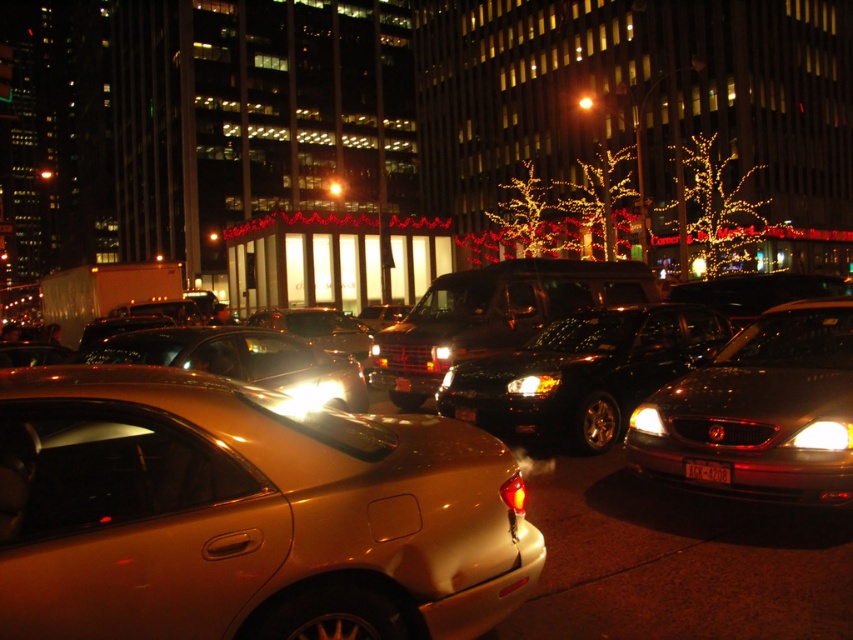
Question: Considering the real-world distances, which object is closest to the white glossy headlight at center?

Choices:
 (A) gold metallic car at center
 (B) matte gold headlight at center-right

Answer: (B)

Question: Considering the relative positions of white glossy headlight at center and matte gold headlight at center-right in the image provided, where is white glossy headlight at center located with respect to matte gold headlight at center-right?

Choices:
 (A) right
 (B) left

Answer: (A)

Question: Considering the relative positions of shiny black suv at center and white glossy headlight at center in the image provided, where is shiny black suv at center located with respect to white glossy headlight at center?

Choices:
 (A) right
 (B) left

Answer: (B)

Question: Which of the following is the farthest from the observer?

Choices:
 (A) (234, 337)
 (B) (845, 448)
 (C) (558, 320)
 (D) (659, 428)

Answer: (C)

Question: Among these points, which one is nearest to the camera?

Choices:
 (A) (851, 445)
 (B) (154, 557)
 (C) (727, 464)
 (D) (537, 436)

Answer: (B)

Question: Does shiny metallic sedan at center have a lesser width compared to matte gold headlight at center-right?

Choices:
 (A) yes
 (B) no

Answer: (B)